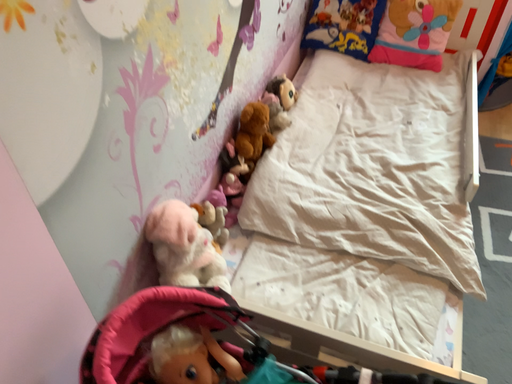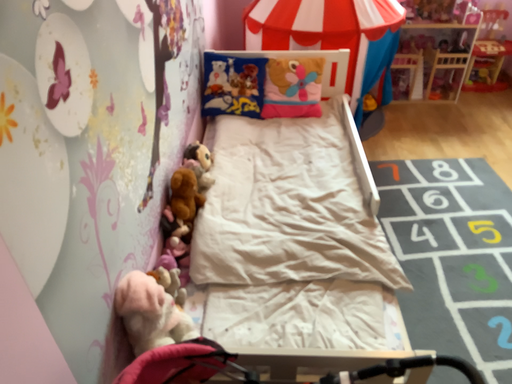
Question: Which way did the camera rotate in the video?

Choices:
 (A) rotated downward
 (B) rotated upward

Answer: (B)